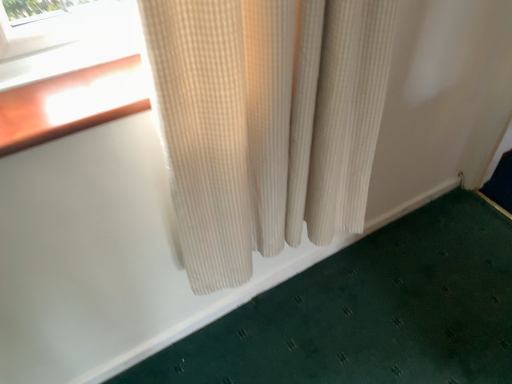
Question: Is green textured bath mat at lower right inside the boundaries of beige corduroy curtain at center, or outside?

Choices:
 (A) outside
 (B) inside

Answer: (A)

Question: From a real-world perspective, relative to beige corduroy curtain at center, is green textured bath mat at lower right vertically above or below?

Choices:
 (A) below
 (B) above

Answer: (A)

Question: In terms of size, does green textured bath mat at lower right appear bigger or smaller than beige corduroy curtain at center?

Choices:
 (A) small
 (B) big

Answer: (A)

Question: In terms of height, does beige corduroy curtain at center look taller or shorter compared to green textured bath mat at lower right?

Choices:
 (A) tall
 (B) short

Answer: (A)

Question: Visually, is beige corduroy curtain at center positioned to the left or to the right of green textured bath mat at lower right?

Choices:
 (A) right
 (B) left

Answer: (B)

Question: Relative to green textured bath mat at lower right, is beige corduroy curtain at center in front or behind?

Choices:
 (A) behind
 (B) front

Answer: (B)

Question: In terms of width, does beige corduroy curtain at center look wider or thinner when compared to green textured bath mat at lower right?

Choices:
 (A) thin
 (B) wide

Answer: (B)